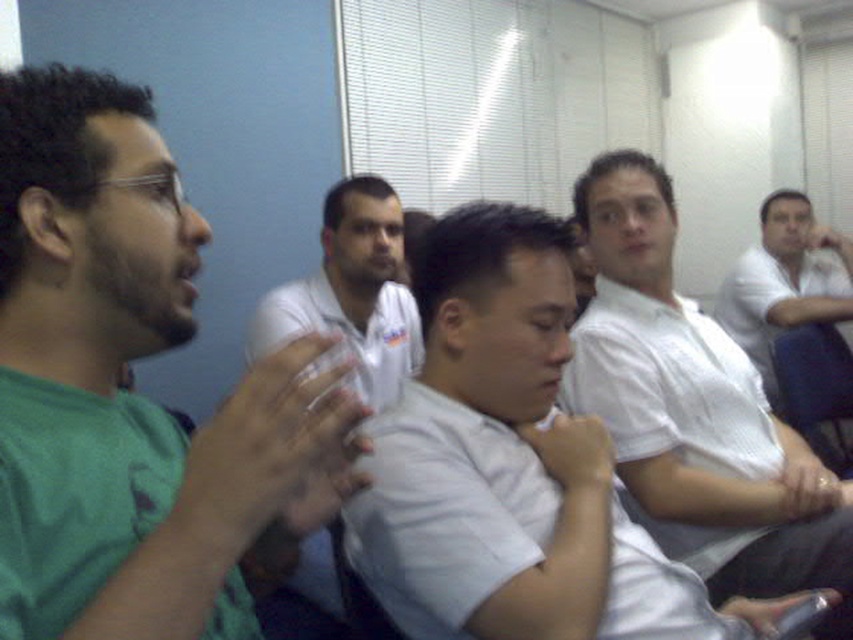
You are a person who needs to pass a notebook from the white cotton shirt at center to the white shirt at center during a meeting. Can you do this without leaving your seat?

The distance between the white cotton shirt at center and the white shirt at center is 27.13 inches, so you can pass the notebook without leaving your seat as the distance is manageable.

You are a photographer positioned at the back of the room. You want to take a photo that clearly shows both the green matte shirt at left and the white shirt at center. Since you can only adjust your focus, which person should you focus on to ensure both are in focus?

You should focus on the green matte shirt at left because it is closer to the viewer than the white shirt at center, so focusing on the closer one will keep both in focus.